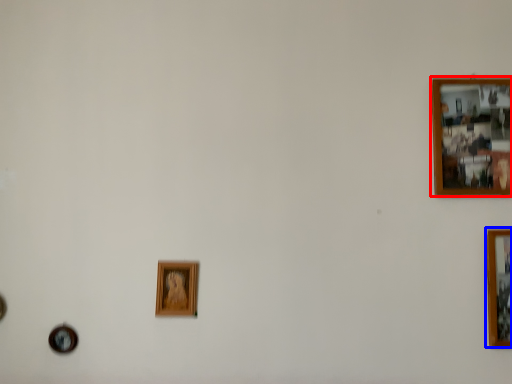
Question: Which object appears closest to the camera in this image, picture frame (highlighted by a red box) or picture frame (highlighted by a blue box)?

Choices:
 (A) picture frame
 (B) picture frame

Answer: (B)